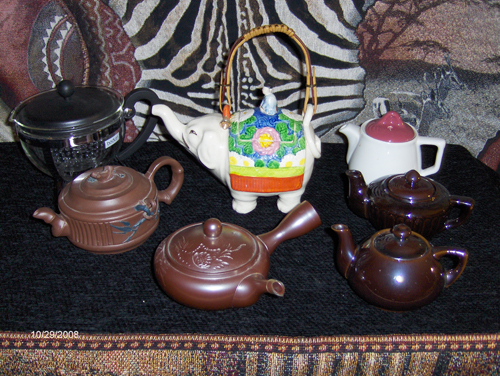
The width and height of the screenshot is (500, 376). I want to click on teapot, so click(387, 154), click(410, 202), click(417, 275), click(247, 267), click(262, 163), click(90, 125).